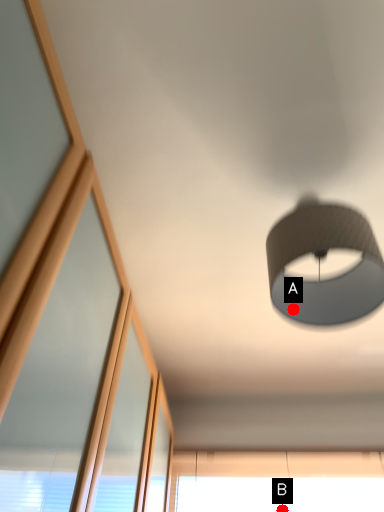
Question: Two points are circled on the image, labeled by A and B beside each circle. Which point is closer to the camera?

Choices:
 (A) A is closer
 (B) B is closer

Answer: (A)